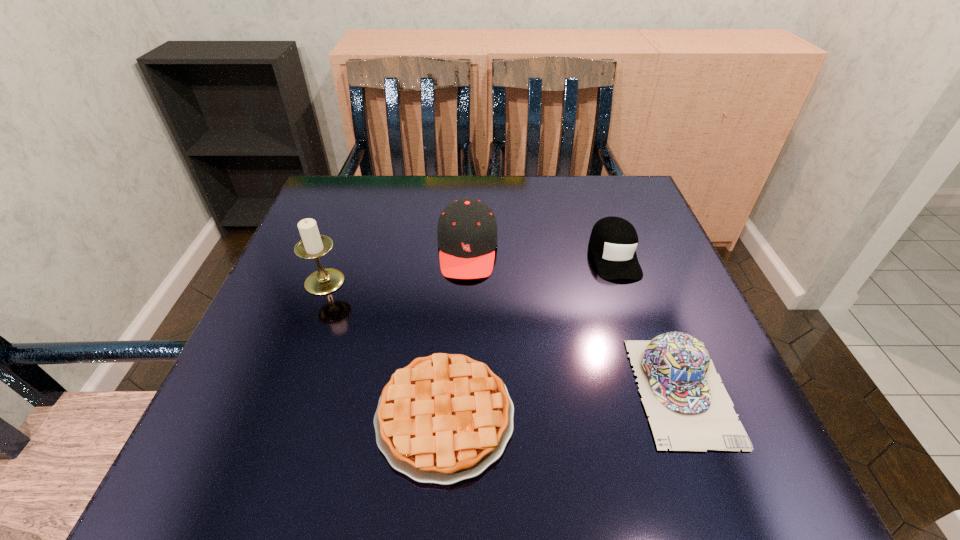
Locate an element on the screen. The image size is (960, 540). cap positioned at the near edge is located at coordinates [690, 410].

The height and width of the screenshot is (540, 960). In order to click on pie present at the near edge in this screenshot , I will do `click(444, 418)`.

Image resolution: width=960 pixels, height=540 pixels. What are the coordinates of `object positioned at the left edge` in the screenshot? It's located at (313, 245).

The image size is (960, 540). In order to click on object that is at the near right corner in this screenshot , I will do `click(690, 410)`.

I want to click on blank area at the far edge, so coord(549,208).

At what (x,y) coordinates should I click in order to perform the action: click on vacant area at the left edge. Please return your answer as a coordinate pair (x, y). Looking at the image, I should click on (339, 259).

In the image, there is a desktop. Identify the location of vacant space at the right edge. (665, 279).

Find the location of a particular element. The image size is (960, 540). vacant space at the near left corner of the desktop is located at coordinates (278, 447).

You are a GUI agent. You are given a task and a screenshot of the screen. Output one action in this format:
    pyautogui.click(x=<x>, y=<y>)
    Task: Click on the vacant space at the far right corner of the desktop
    
    Given the screenshot: What is the action you would take?
    pyautogui.click(x=645, y=205)

You are a GUI agent. You are given a task and a screenshot of the screen. Output one action in this format:
    pyautogui.click(x=<x>, y=<y>)
    Task: Click on the blank region between the nearest cap and the candle holder
    This screenshot has height=540, width=960.
    Given the screenshot: What is the action you would take?
    (x=503, y=336)